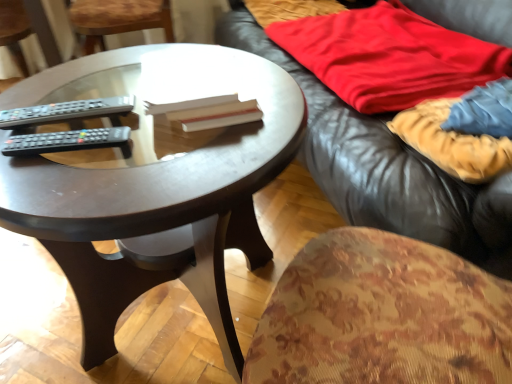
Locate an element on the screen. The image size is (512, 384). vacant area that is in front of black plastic remote at center, marked as the 1th remote control in a back-to-front arrangement is located at coordinates (71, 185).